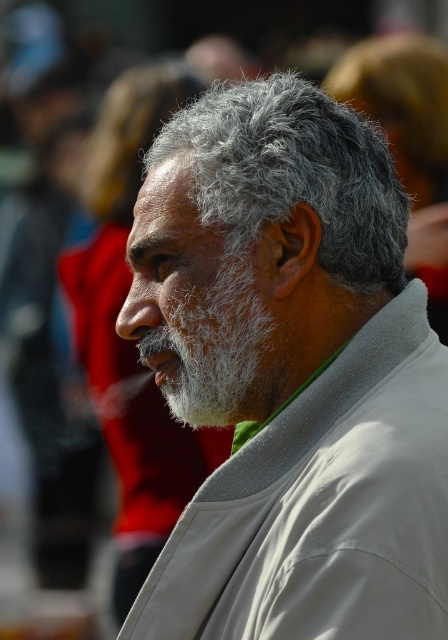
You are taking a photo of the gray fluffy hair at center. If you want to focus on the exact center of the image, which is at point coordinates of 0.5, 0.5, should you move the camera upwards or downwards?

The gray fluffy hair at center is located at point coordinates of (293, 173). Since the y coordinate 0.656 is higher than 0.5, you should move the camera downwards to bring the focus to the exact center of the image.

What are the coordinates of the gray hair at center in the image?

The gray hair at center is located at coordinates point (x=289, y=372).